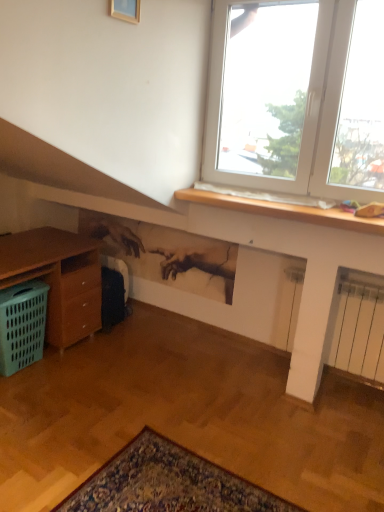
Image resolution: width=384 pixels, height=512 pixels. What do you see at coordinates (22, 325) in the screenshot?
I see `green plastic basket at lower left` at bounding box center [22, 325].

What are the coordinates of `green plastic basket at lower left` in the screenshot? It's located at (22, 325).

Where is `gold wooden picture frame at upper center`? This screenshot has height=512, width=384. gold wooden picture frame at upper center is located at coordinates (125, 10).

What do you see at coordinates (125, 10) in the screenshot?
I see `gold wooden picture frame at upper center` at bounding box center [125, 10].

In order to face gold wooden picture frame at upper center, should I rotate leftwards or rightwards?

Turn left by 8.920 degrees to look at gold wooden picture frame at upper center.

The height and width of the screenshot is (512, 384). Identify the location of green plastic basket at lower left. (22, 325).

Considering the relative positions of gold wooden picture frame at upper center and green plastic basket at lower left in the image provided, is gold wooden picture frame at upper center to the left of green plastic basket at lower left from the viewer's perspective?

In fact, gold wooden picture frame at upper center is to the right of green plastic basket at lower left.

Is gold wooden picture frame at upper center positioned behind green plastic basket at lower left?

No, gold wooden picture frame at upper center is closer to the camera.

Does point (112, 13) appear closer or farther from the camera than point (28, 316)?

Point (112, 13) appears to be closer to the viewer than point (28, 316).

From the image's perspective, is gold wooden picture frame at upper center located beneath green plastic basket at lower left?

No, from the image's perspective, gold wooden picture frame at upper center is not beneath green plastic basket at lower left.

From a real-world perspective, is gold wooden picture frame at upper center on green plastic basket at lower left?

Yes, from a real-world perspective, gold wooden picture frame at upper center is above green plastic basket at lower left.

Which of these two, gold wooden picture frame at upper center or green plastic basket at lower left, is wider?

green plastic basket at lower left.

From the picture: Can you confirm if gold wooden picture frame at upper center is shorter than green plastic basket at lower left?

Yes, gold wooden picture frame at upper center is shorter than green plastic basket at lower left.

Looking at the image, does gold wooden picture frame at upper center seem bigger or smaller compared to green plastic basket at lower left?

In the image, gold wooden picture frame at upper center appears to be smaller than green plastic basket at lower left.

Could green plastic basket at lower left be considered to be inside gold wooden picture frame at upper center?

No, gold wooden picture frame at upper center does not contain green plastic basket at lower left.

Is gold wooden picture frame at upper center next to green plastic basket at lower left?

No, gold wooden picture frame at upper center is not beside green plastic basket at lower left.

Is gold wooden picture frame at upper center turned away from green plastic basket at lower left?

No.

How many degrees apart are the facing directions of gold wooden picture frame at upper center and green plastic basket at lower left?

1.98 degrees.

Locate an element on the screen. The height and width of the screenshot is (512, 384). picture frame that appears above the green plastic basket at lower left (from the image's perspective) is located at coordinates (125, 10).

In the scene shown: Does green plastic basket at lower left appear on the left side of gold wooden picture frame at upper center?

Yes.

Does green plastic basket at lower left lie behind gold wooden picture frame at upper center?

Yes, green plastic basket at lower left is further from the viewer.

Is point (10, 303) closer to camera compared to point (115, 5)?

No, it is behind (115, 5).

From the picture: From the image's perspective, is green plastic basket at lower left above or below gold wooden picture frame at upper center?

green plastic basket at lower left is situated lower than gold wooden picture frame at upper center in the image.

From a real-world perspective, which object stands above the other?

gold wooden picture frame at upper center, from a real-world perspective.

Is green plastic basket at lower left wider or thinner than gold wooden picture frame at upper center?

Considering their sizes, green plastic basket at lower left looks broader than gold wooden picture frame at upper center.

Which of these two, green plastic basket at lower left or gold wooden picture frame at upper center, stands shorter?

gold wooden picture frame at upper center.

Is green plastic basket at lower left smaller than gold wooden picture frame at upper center?

No.

Is green plastic basket at lower left located outside gold wooden picture frame at upper center?

green plastic basket at lower left is positioned outside gold wooden picture frame at upper center.

Are green plastic basket at lower left and gold wooden picture frame at upper center far apart?

Indeed, green plastic basket at lower left is not near gold wooden picture frame at upper center.

In the scene shown: Is green plastic basket at lower left looking in the opposite direction of gold wooden picture frame at upper center?

No, gold wooden picture frame at upper center is not at the back of green plastic basket at lower left.

Identify the location of picture frame located in front of the green plastic basket at lower left. (125, 10).

In the image, there is a gold wooden picture frame at upper center. Where is `basket below it (from the image's perspective)`? Image resolution: width=384 pixels, height=512 pixels. basket below it (from the image's perspective) is located at coordinates (22, 325).

Where is `basket on the left of gold wooden picture frame at upper center`? This screenshot has height=512, width=384. basket on the left of gold wooden picture frame at upper center is located at coordinates (x=22, y=325).